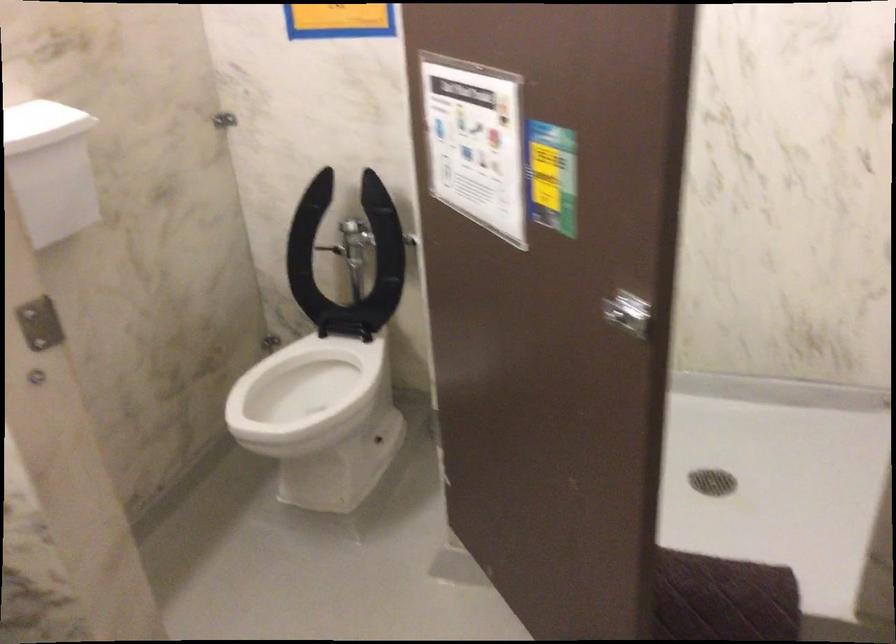
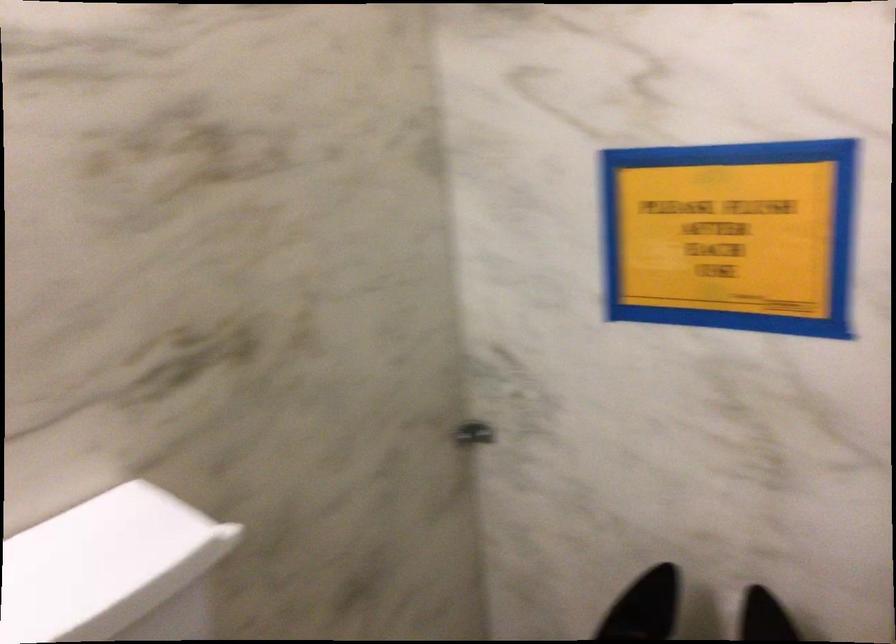
What movement of the cameraman would produce the second image?

The cameraman walked toward left, forward.